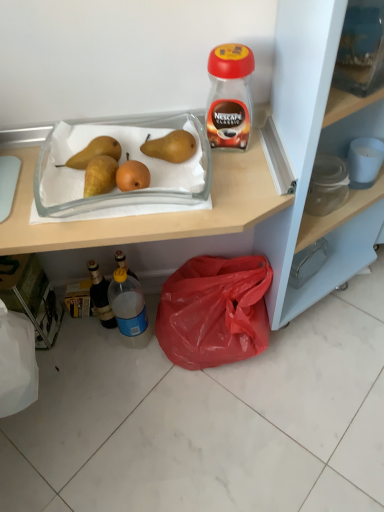
Locate an element on the screen. The image size is (384, 512). free location in front of red plastic bag at lower right is located at coordinates (220, 421).